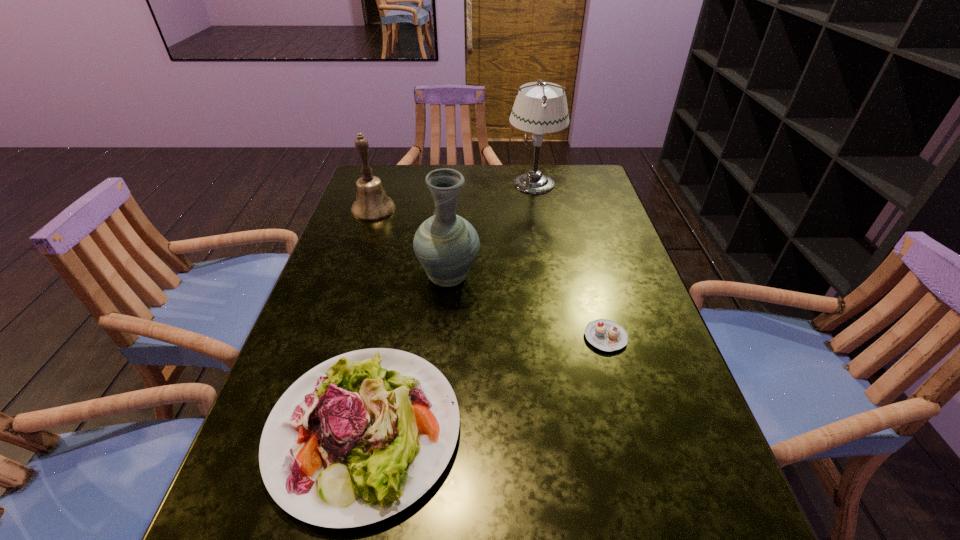
I want to click on free space between the salad plate and the bell, so click(x=369, y=319).

Image resolution: width=960 pixels, height=540 pixels. I want to click on vacant point located between the farthest object and the fourth farthest object, so click(569, 260).

Image resolution: width=960 pixels, height=540 pixels. I want to click on free spot between the fourth tallest object and the cupcake, so click(x=485, y=383).

Locate an element on the screen. Image resolution: width=960 pixels, height=540 pixels. empty space between the pitcher and the farthest object is located at coordinates (492, 231).

Locate an element on the screen. The width and height of the screenshot is (960, 540). object that can be found as the fourth closest to the salad plate is located at coordinates click(543, 109).

Locate an element on the screen. Image resolution: width=960 pixels, height=540 pixels. object that is the closest to the farthest object is located at coordinates (446, 245).

Identify the location of free space that satisfies the following two spatial constraints: 1. on the lampshade of the lampshade; 2. on the right side of the shortest object. (563, 337).

Identify the location of free region that satisfies the following two spatial constraints: 1. on the lampshade of the farthest object; 2. on the left side of the shortest object. point(563,337).

This screenshot has width=960, height=540. I want to click on vacant area in the image that satisfies the following two spatial constraints: 1. on the lampshade of the cupcake; 2. on the left side of the lampshade, so click(563, 337).